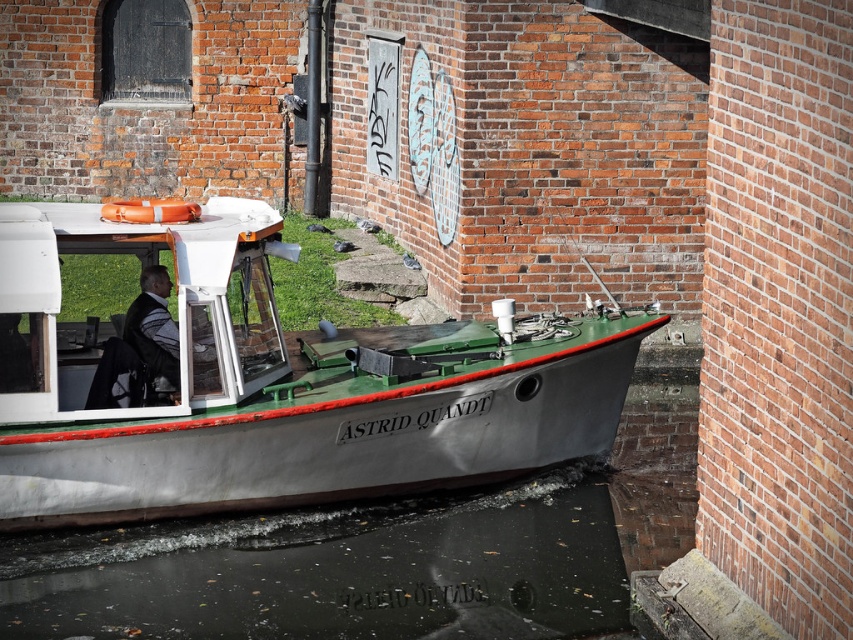
This screenshot has height=640, width=853. I want to click on green matte boat at center, so click(x=264, y=381).

Between point (228, 378) and point (157, 317), which one is positioned behind?

The point (157, 317) is behind.

Is point (366, 429) less distant than point (123, 333)?

Yes.

The image size is (853, 640). Identify the location of green matte boat at center. (264, 381).

How much distance is there between green matte boat at center and dark gray water at lower center?

They are 39.04 inches apart.

Between green matte boat at center and dark gray water at lower center, which one is positioned lower?

Positioned lower is dark gray water at lower center.

Does point (276, 416) come closer to viewer compared to point (297, 582)?

No, (276, 416) is behind (297, 582).

This screenshot has height=640, width=853. What are the coordinates of `green matte boat at center` in the screenshot? It's located at (264, 381).

Can you confirm if dark gray water at lower center is positioned to the right of gray fabric jacket at center?

Yes, dark gray water at lower center is to the right of gray fabric jacket at center.

Looking at this image, who is positioned more to the left, dark gray water at lower center or gray fabric jacket at center?

From the viewer's perspective, gray fabric jacket at center appears more on the left side.

Is point (357, 632) more distant than point (198, 342)?

No, it is not.

Find the location of `dark gray water at lower center`. dark gray water at lower center is located at coordinates (363, 566).